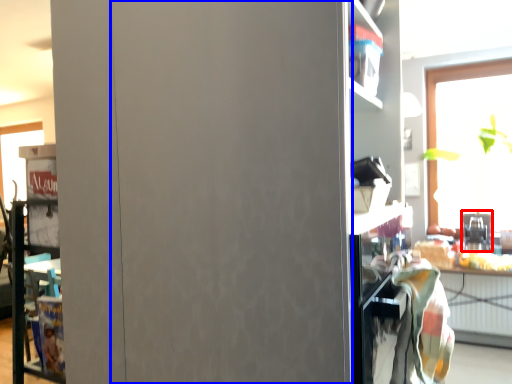
Question: Among these objects, which one is nearest to the camera, appliance (highlighted by a red box) or garage door (highlighted by a blue box)?

Choices:
 (A) appliance
 (B) garage door

Answer: (B)